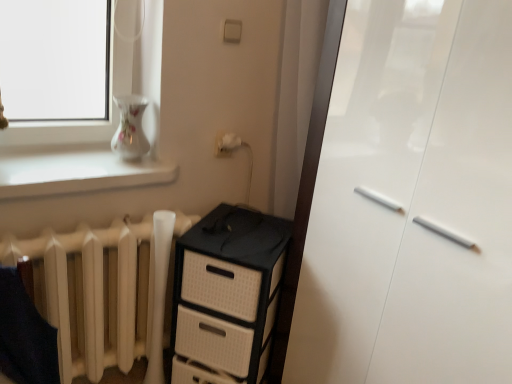
Question: Is black plastic chest of drawers at center further to camera compared to white matte radiator at lower left?

Choices:
 (A) no
 (B) yes

Answer: (B)

Question: From a real-world perspective, is black plastic chest of drawers at center positioned over white matte radiator at lower left based on gravity?

Choices:
 (A) yes
 (B) no

Answer: (B)

Question: Considering the relative positions of black plastic chest of drawers at center and white matte radiator at lower left in the image provided, is black plastic chest of drawers at center to the left of white matte radiator at lower left from the viewer's perspective?

Choices:
 (A) yes
 (B) no

Answer: (B)

Question: Is black plastic chest of drawers at center turned away from white matte radiator at lower left?

Choices:
 (A) yes
 (B) no

Answer: (B)

Question: Does black plastic chest of drawers at center have a greater height compared to white matte radiator at lower left?

Choices:
 (A) yes
 (B) no

Answer: (A)

Question: In terms of height, does black plastic chest of drawers at center look taller or shorter compared to white glossy vase at upper left?

Choices:
 (A) short
 (B) tall

Answer: (B)

Question: Do you think black plastic chest of drawers at center is within white glossy vase at upper left, or outside of it?

Choices:
 (A) outside
 (B) inside

Answer: (A)

Question: From the image's perspective, is black plastic chest of drawers at center positioned above or below white glossy vase at upper left?

Choices:
 (A) below
 (B) above

Answer: (A)

Question: Considering the positions of black plastic chest of drawers at center and white glossy vase at upper left in the image, is black plastic chest of drawers at center bigger or smaller than white glossy vase at upper left?

Choices:
 (A) big
 (B) small

Answer: (A)

Question: From a real-world perspective, is black plastic chest of drawers at center positioned above or below white matte radiator at lower left?

Choices:
 (A) above
 (B) below

Answer: (B)

Question: Looking at the image, does black plastic chest of drawers at center seem bigger or smaller compared to white matte radiator at lower left?

Choices:
 (A) big
 (B) small

Answer: (A)

Question: Considering the positions of point (252, 379) and point (131, 319), is point (252, 379) closer or farther from the camera than point (131, 319)?

Choices:
 (A) farther
 (B) closer

Answer: (A)

Question: Would you say black plastic chest of drawers at center is inside or outside white matte radiator at lower left?

Choices:
 (A) outside
 (B) inside

Answer: (A)

Question: In terms of size, does white glossy cabinet at right appear bigger or smaller than black plastic chest of drawers at center?

Choices:
 (A) big
 (B) small

Answer: (A)

Question: Does point (356, 122) appear closer or farther from the camera than point (202, 347)?

Choices:
 (A) closer
 (B) farther

Answer: (A)